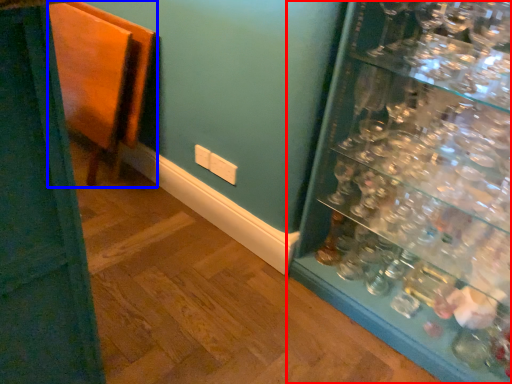
Question: Among these objects, which one is nearest to the camera, shelf (highlighted by a red box) or furniture (highlighted by a blue box)?

Choices:
 (A) shelf
 (B) furniture

Answer: (A)